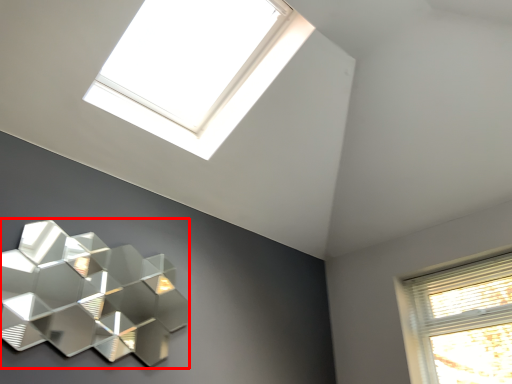
Question: From the image's perspective, what is the correct spatial positioning of lamp (annotated by the red box) in reference to window?

Choices:
 (A) below
 (B) above

Answer: (A)